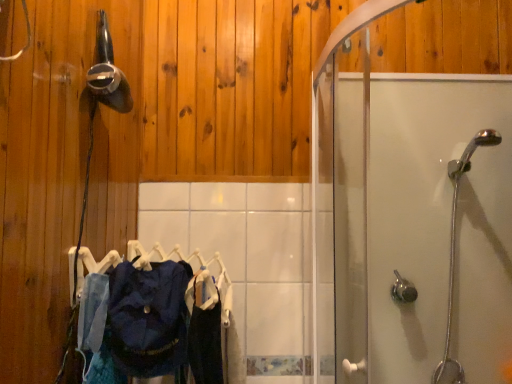
Question: Is chrome metallic showerhead at right, which is counted as the first shower, starting from the right, positioned far away from metallic silver hairdryer at upper left, the third shower ordered from the bottom?

Choices:
 (A) no
 (B) yes

Answer: (B)

Question: Is chrome metallic showerhead at right, placed as the 2th shower when sorted from top to bottom, completely or partially outside of metallic silver hairdryer at upper left, the 1th shower positioned from the left?

Choices:
 (A) yes
 (B) no

Answer: (A)

Question: Is chrome metallic showerhead at right, placed as the 2th shower when sorted from top to bottom, oriented away from metallic silver hairdryer at upper left, the third shower ordered from the bottom?

Choices:
 (A) yes
 (B) no

Answer: (B)

Question: From a real-world perspective, is chrome metallic showerhead at right, which is counted as the first shower, starting from the right, over metallic silver hairdryer at upper left, the third shower viewed from the right?

Choices:
 (A) yes
 (B) no

Answer: (B)

Question: Is chrome metallic showerhead at right, which ranks as the 3th shower in left-to-right order, to the right of metallic silver hairdryer at upper left, which is counted as the 1th shower, starting from the top, from the viewer's perspective?

Choices:
 (A) no
 (B) yes

Answer: (B)

Question: Considering the positions of satin nickel shower handle at lower right, the third shower positioned from the top, and transparent glass shower door at right in the image, is satin nickel shower handle at lower right, the third shower positioned from the top, taller or shorter than transparent glass shower door at right?

Choices:
 (A) short
 (B) tall

Answer: (A)

Question: From a real-world perspective, relative to transparent glass shower door at right, is satin nickel shower handle at lower right, which is the 2th shower from right to left, vertically above or below?

Choices:
 (A) above
 (B) below

Answer: (B)

Question: Is satin nickel shower handle at lower right, the third shower positioned from the top, bigger or smaller than transparent glass shower door at right?

Choices:
 (A) small
 (B) big

Answer: (A)

Question: Choose the correct answer: Is satin nickel shower handle at lower right, the third shower positioned from the top, inside transparent glass shower door at right or outside it?

Choices:
 (A) inside
 (B) outside

Answer: (A)

Question: Choose the correct answer: Is dark blue fabric at center, the first clothing in the left-to-right sequence, inside chrome metallic showerhead at right, which is counted as the second shower, starting from the bottom, or outside it?

Choices:
 (A) outside
 (B) inside

Answer: (A)

Question: Considering the positions of point (157, 359) and point (456, 165), is point (157, 359) closer or farther from the camera than point (456, 165)?

Choices:
 (A) closer
 (B) farther

Answer: (A)

Question: Would you say dark blue fabric at center, which is counted as the second clothing, starting from the right, is to the left or to the right of chrome metallic showerhead at right, which is counted as the second shower, starting from the bottom, in the picture?

Choices:
 (A) left
 (B) right

Answer: (A)

Question: From the image's perspective, is dark blue fabric at center, which is counted as the second clothing, starting from the right, above or below chrome metallic showerhead at right, placed as the 2th shower when sorted from top to bottom?

Choices:
 (A) above
 (B) below

Answer: (B)

Question: From the image's perspective, relative to dark blue fabric at center, the second clothing when ordered from left to right, is satin nickel shower handle at lower right, which is the 2th shower from right to left, above or below?

Choices:
 (A) above
 (B) below

Answer: (A)

Question: Based on their sizes in the image, would you say satin nickel shower handle at lower right, which is the 2th shower from right to left, is bigger or smaller than dark blue fabric at center, acting as the 1th clothing starting from the right?

Choices:
 (A) small
 (B) big

Answer: (A)